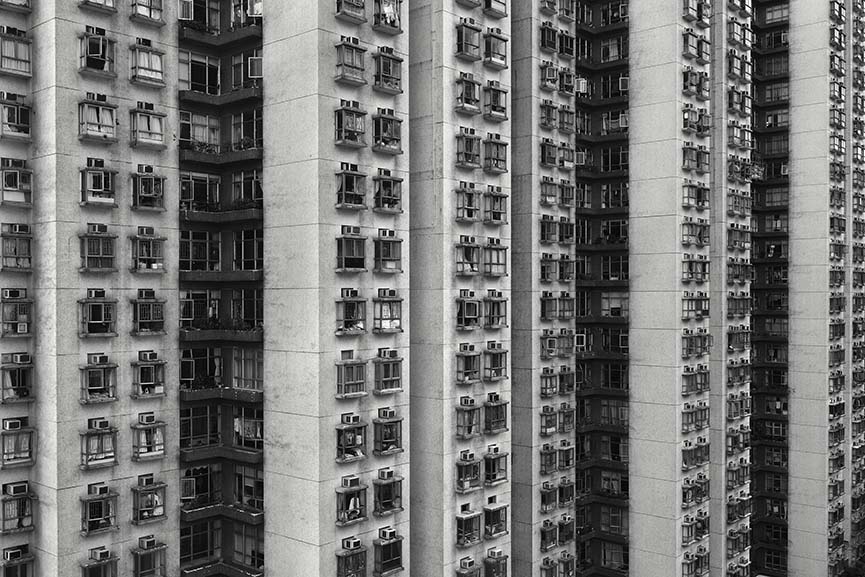
The image size is (865, 577). I want to click on window unit farthest bottom right in image, so click(857, 569).